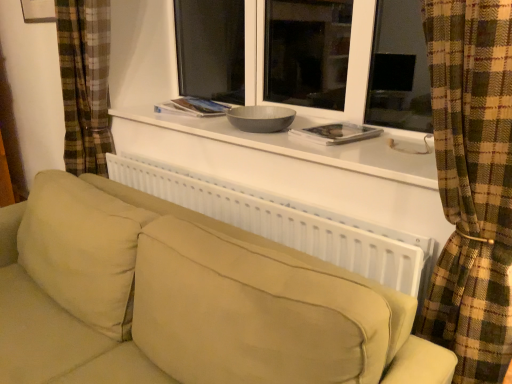
Question: Choose the correct answer: Is white matte window sill at upper center inside beige fabric couch at center or outside it?

Choices:
 (A) inside
 (B) outside

Answer: (B)

Question: Considering the relative positions of white matte window sill at upper center and beige fabric couch at center in the image provided, is white matte window sill at upper center to the left or to the right of beige fabric couch at center?

Choices:
 (A) right
 (B) left

Answer: (A)

Question: Which is nearer to the white matte window sill at upper center?

Choices:
 (A) white plastic radiator at center
 (B) white paper book at center, which is the first book from front to back
 (C) beige fabric couch at center
 (D) hardcover book at center, the 1th book from the left

Answer: (B)

Question: Estimate the real-world distances between objects in this image. Which object is closer to the hardcover book at center, the second book when ordered from bottom to top?

Choices:
 (A) white paper book at center, marked as the first book in a bottom-to-top arrangement
 (B) white matte window sill at upper center
 (C) beige fabric couch at center
 (D) white plastic radiator at center

Answer: (B)